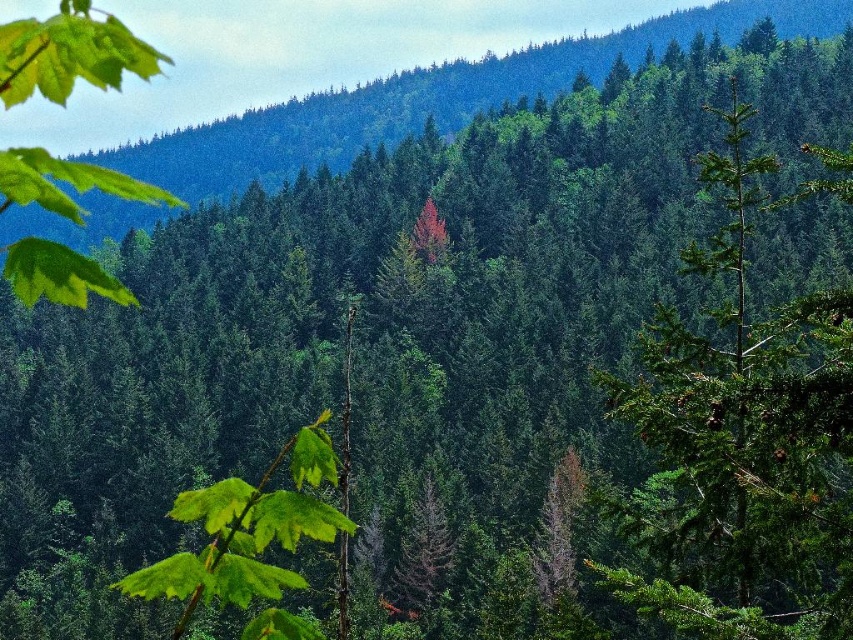
You are an explorer in the forest and need to find a clear path. You see the green matte forest at center and the green matte leaf at upper left. Which object is closer to you?

The green matte leaf at upper left is closer because it is taller than the green matte forest at center, indicating it is in front.